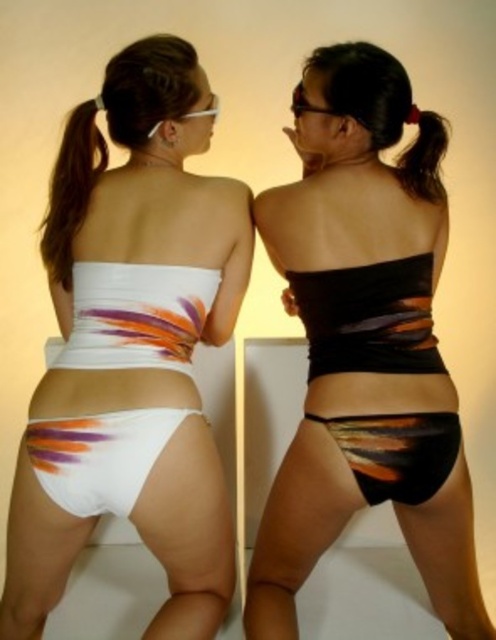
Question: Among these objects, which one is farthest from the camera?

Choices:
 (A) white matte bikini bottom at lower left
 (B) brown hair at upper left

Answer: (B)

Question: Does white matte bikini bottom at center have a greater width compared to brown shiny hair at upper right?

Choices:
 (A) no
 (B) yes

Answer: (B)

Question: Where is white matte bikini bottom at center located in relation to black matte bikini top at center in the image?

Choices:
 (A) below
 (B) above

Answer: (A)

Question: Which point is farther to the camera?

Choices:
 (A) 424,148
 (B) 47,248

Answer: (B)

Question: Which point is farther to the camera?

Choices:
 (A) black matte bikini top at center
 (B) white matte bikini bottom at center

Answer: (A)

Question: Is black matte bikini top at center to the right of white matte bikini bottom at lower left from the viewer's perspective?

Choices:
 (A) yes
 (B) no

Answer: (A)